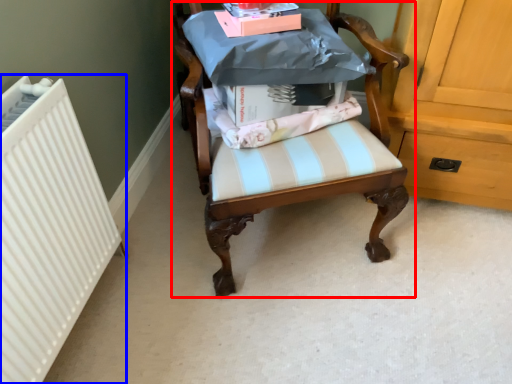
Question: Which object appears closest to the camera in this image, chair (highlighted by a red box) or radiator (highlighted by a blue box)?

Choices:
 (A) chair
 (B) radiator

Answer: (A)